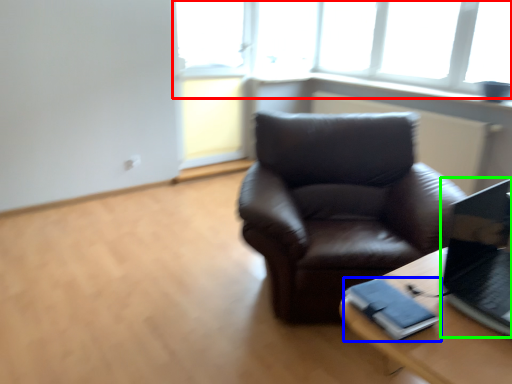
Question: Estimate the real-world distances between objects in this image. Which object is farther from window (highlighted by a red box), binder (highlighted by a blue box) or laptop (highlighted by a green box)?

Choices:
 (A) binder
 (B) laptop

Answer: (A)